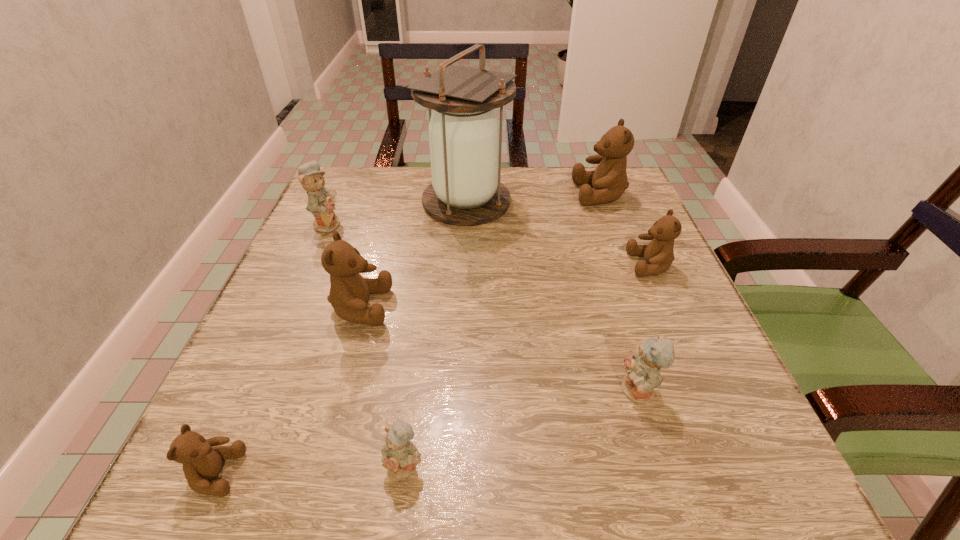
The image size is (960, 540). I want to click on object that is at the near left corner, so click(202, 462).

The height and width of the screenshot is (540, 960). In order to click on object at the far right corner in this screenshot , I will do `click(609, 180)`.

In the image, there is a desktop. Find the location of `free region at the far edge`. free region at the far edge is located at coordinates (531, 208).

At what (x,y) coordinates should I click in order to perform the action: click on vacant area at the near edge of the desktop. Please return your answer as a coordinate pair (x, y). The height and width of the screenshot is (540, 960). Looking at the image, I should click on (499, 465).

Identify the location of free space at the left edge of the desktop. (305, 246).

Find the location of a particular element. This screenshot has height=540, width=960. vacant space at the right edge of the desktop is located at coordinates (636, 220).

Locate an element on the screen. free region at the far left corner of the desktop is located at coordinates (382, 206).

Find the location of a particular element. The height and width of the screenshot is (540, 960). free space at the far right corner is located at coordinates (570, 174).

What are the coordinates of `empty space that is in between the tallest object and the leftmost brown teddy bear` in the screenshot? It's located at (341, 338).

This screenshot has width=960, height=540. I want to click on vacant space that's between the fifth nearest teddy bear and the tallest object, so click(559, 233).